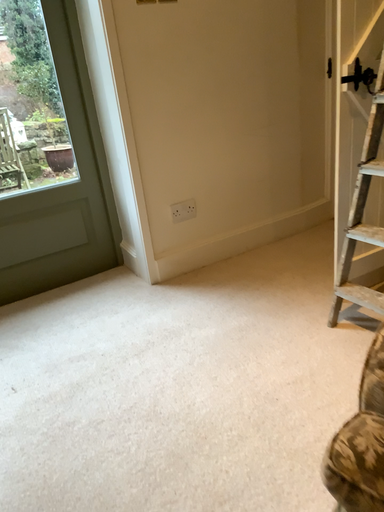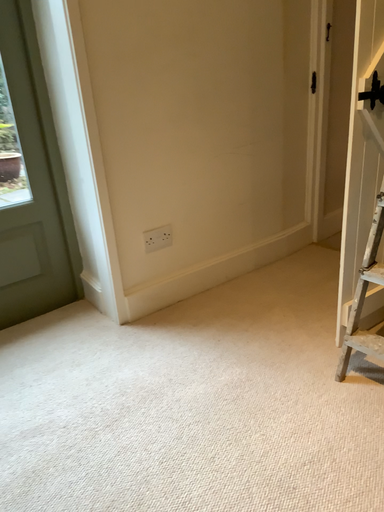
Question: How did the camera likely rotate when shooting the video?

Choices:
 (A) rotated right
 (B) rotated left

Answer: (A)